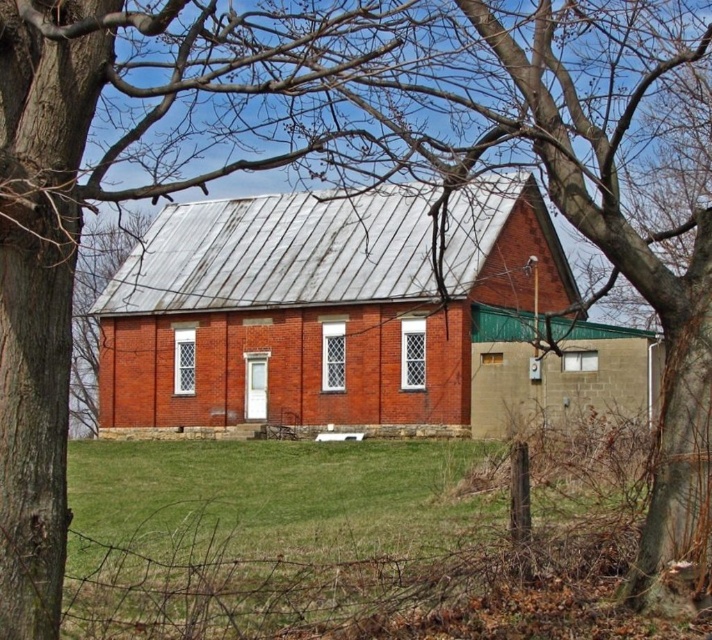
Question: Can you confirm if brick barn at center is thinner than green grass at center?

Choices:
 (A) yes
 (B) no

Answer: (B)

Question: Which point is closer to the camera?

Choices:
 (A) (450, 429)
 (B) (557, 518)

Answer: (B)

Question: Does brick barn at center appear under green grass at center?

Choices:
 (A) no
 (B) yes

Answer: (A)

Question: Among these objects, which one is farthest from the camera?

Choices:
 (A) brick barn at center
 (B) green grass at center

Answer: (A)

Question: Which point is closer to the camera?

Choices:
 (A) (266, 307)
 (B) (122, 499)

Answer: (B)

Question: Does brick barn at center appear under green grass at center?

Choices:
 (A) no
 (B) yes

Answer: (A)